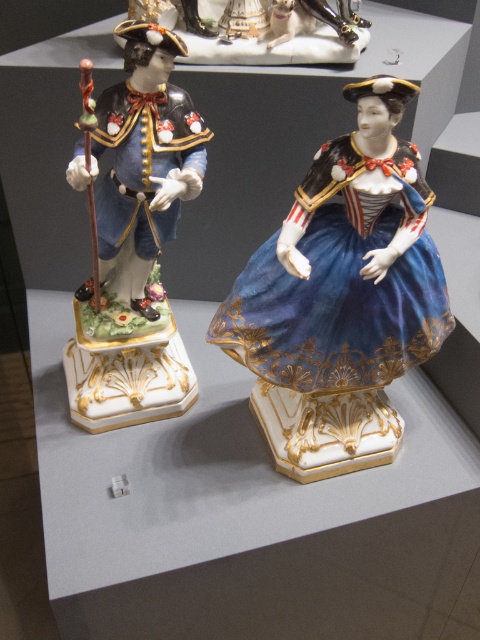
Question: Is velvet blue dress at center to the right of porcelain statue at upper center from the viewer's perspective?

Choices:
 (A) no
 (B) yes

Answer: (B)

Question: Does porcelain figurine at left appear under porcelain statue at upper center?

Choices:
 (A) yes
 (B) no

Answer: (A)

Question: Estimate the real-world distances between objects in this image. Which object is farther from the porcelain figurine at left?

Choices:
 (A) porcelain statue at upper center
 (B) velvet blue dress at center

Answer: (A)

Question: Among these objects, which one is farthest from the camera?

Choices:
 (A) velvet blue dress at center
 (B) porcelain figurine at left

Answer: (B)

Question: Which of the following is the closest to the observer?

Choices:
 (A) velvet blue dress at center
 (B) porcelain figurine at left
 (C) porcelain statue at upper center

Answer: (A)

Question: Is velvet blue dress at center positioned behind porcelain figurine at left?

Choices:
 (A) no
 (B) yes

Answer: (A)